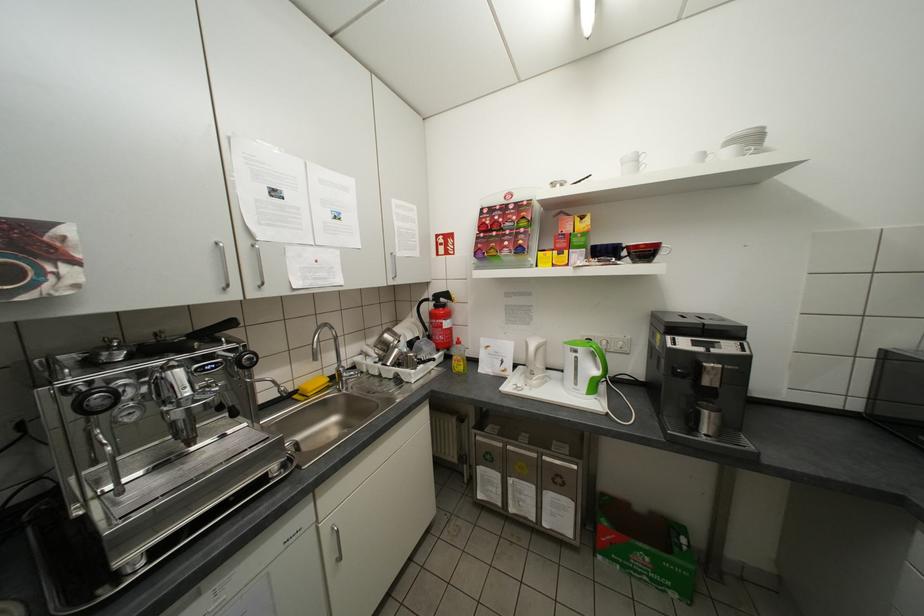
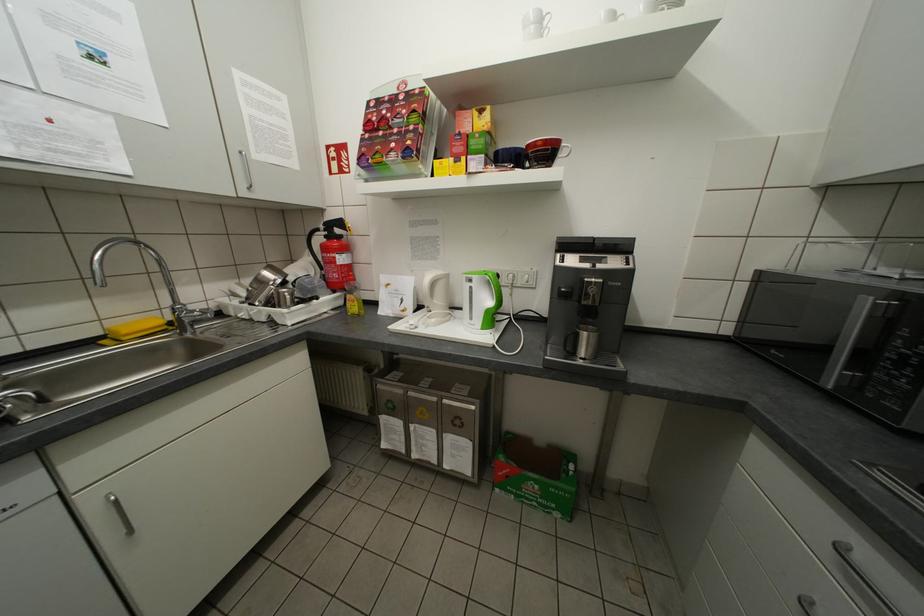
Locate, in the second image, the point that corresponds to the point at 487,438 in the first image.

(387, 387)